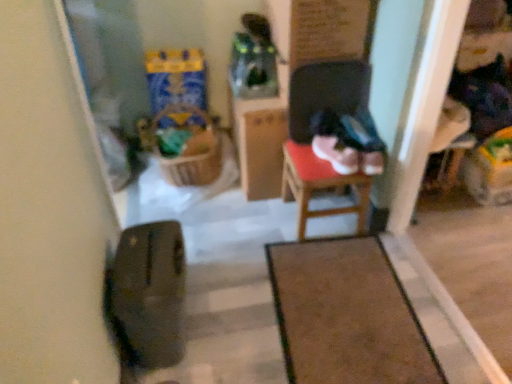
What do you see at coordinates (111, 71) in the screenshot? Image resolution: width=512 pixels, height=384 pixels. I see `transparent glass door at left` at bounding box center [111, 71].

This screenshot has width=512, height=384. Describe the element at coordinates (449, 144) in the screenshot. I see `wooden armchair at right` at that location.

I want to click on woven brown laundry basket at center, so click(x=190, y=156).

Describe the element at coordinates (346, 315) in the screenshot. I see `brown carpet at center` at that location.

This screenshot has height=384, width=512. I want to click on brown carpet at center, so click(x=346, y=315).

Where is `transparent glass door at left`? The height and width of the screenshot is (384, 512). transparent glass door at left is located at coordinates (111, 71).

Are wooden armchair at right and brown carpet at center making contact?

wooden armchair at right and brown carpet at center are not in contact.

Consider the image. Considering the sizes of objects wooden armchair at right and brown carpet at center in the image provided, who is taller, wooden armchair at right or brown carpet at center?

wooden armchair at right is taller.

Is point (458, 151) positioned behind point (350, 299)?

Yes, point (458, 151) is farther from viewer.

Considering the sizes of objects wooden armchair at right and brown carpet at center in the image provided, who is smaller, wooden armchair at right or brown carpet at center?

Smaller between the two is brown carpet at center.

Is point (122, 30) positioned after point (176, 165)?

No.

Considering the sizes of transparent glass door at left and woven brown laundry basket at center in the image, is transparent glass door at left bigger or smaller than woven brown laundry basket at center?

Considering their sizes, transparent glass door at left takes up less space than woven brown laundry basket at center.

Are transparent glass door at left and woven brown laundry basket at center located far from each other?

No, there isn't a large distance between transparent glass door at left and woven brown laundry basket at center.

Locate an element on the screen. laundry basket below the transparent glass door at left (from a real-world perspective) is located at coordinates (190, 156).

Is point (203, 184) closer to viewer compared to point (124, 86)?

Yes, point (203, 184) is closer to viewer.

How different are the orientations of woven brown laundry basket at center and transparent glass door at left in degrees?

They differ by 90.2 degrees in their facing directions.

Between woven brown laundry basket at center and transparent glass door at left, which one has smaller size?

transparent glass door at left.

Does woven brown laundry basket at center turn towards transparent glass door at left?

No.

Is woven brown laundry basket at center situated inside brown carpet at center or outside?

woven brown laundry basket at center is not inside brown carpet at center, it's outside.

Consider the image. From a real-world perspective, who is located higher, woven brown laundry basket at center or brown carpet at center?

woven brown laundry basket at center, from a real-world perspective.

From the image's perspective, does woven brown laundry basket at center appear lower than brown carpet at center?

No, from the image's perspective, woven brown laundry basket at center is not beneath brown carpet at center.

Based on the photo, is woven brown laundry basket at center at the right side of brown carpet at center?

No, woven brown laundry basket at center is not to the right of brown carpet at center.

Does woven brown laundry basket at center contain wooden armchair at right?

That's incorrect, wooden armchair at right is not inside woven brown laundry basket at center.

Is woven brown laundry basket at center directly adjacent to wooden armchair at right?

They are not placed beside each other.

Is woven brown laundry basket at center taller than wooden armchair at right?

No, woven brown laundry basket at center is not taller than wooden armchair at right.

The height and width of the screenshot is (384, 512). In order to click on laundry basket to the left of wooden armchair at right in this screenshot , I will do `click(190, 156)`.

From the picture: Who is more distant, wooden chair at center or woven brown laundry basket at center?

woven brown laundry basket at center.

Looking at the image, does wooden chair at center seem bigger or smaller compared to woven brown laundry basket at center?

wooden chair at center is smaller than woven brown laundry basket at center.

Is wooden chair at center aimed at woven brown laundry basket at center?

No, wooden chair at center is not facing towards woven brown laundry basket at center.

Find the location of a particular element. Image resolution: width=512 pixels, height=384 pixels. laundry basket positioned vertically above the wooden chair at center (from a real-world perspective) is located at coordinates (190, 156).

Is wooden armchair at right spatially inside woven brown laundry basket at center, or outside of it?

wooden armchair at right exists outside the volume of woven brown laundry basket at center.

Is wooden armchair at right bigger or smaller than woven brown laundry basket at center?

Considering their sizes, wooden armchair at right takes up less space than woven brown laundry basket at center.

In terms of height, does wooden armchair at right look taller or shorter compared to woven brown laundry basket at center?

wooden armchair at right is taller than woven brown laundry basket at center.

Does wooden armchair at right appear on the left side of woven brown laundry basket at center?

No, wooden armchair at right is not to the left of woven brown laundry basket at center.

Identify the location of furniture in front of the wooden armchair at right. Image resolution: width=512 pixels, height=384 pixels. pos(346,315).

What are the coordinates of `glass door located above the woven brown laundry basket at center (from a real-world perspective)` in the screenshot? It's located at (111, 71).

Considering their positions, is wooden chair at center positioned further to woven brown laundry basket at center than brown carpet at center?

The object further to woven brown laundry basket at center is brown carpet at center.

Based on their spatial positions, is wooden chair at center or woven brown laundry basket at center closer to transparent glass door at left?

Among the two, woven brown laundry basket at center is located nearer to transparent glass door at left.

Estimate the real-world distances between objects in this image. Which object is further from brown carpet at center, wooden armchair at right or transparent glass door at left?

transparent glass door at left lies further to brown carpet at center than the other object.

Which object lies nearer to the anchor point woven brown laundry basket at center, brown carpet at center or wooden armchair at right?

brown carpet at center is closer to woven brown laundry basket at center.

Estimate the real-world distances between objects in this image. Which object is closer to brown carpet at center, woven brown laundry basket at center or wooden chair at center?

The object closer to brown carpet at center is wooden chair at center.

Looking at the image, which one is located closer to wooden chair at center, woven brown laundry basket at center or brown carpet at center?

brown carpet at center is positioned closer to the anchor wooden chair at center.

Estimate the real-world distances between objects in this image. Which object is closer to woven brown laundry basket at center, wooden chair at center or transparent glass door at left?

transparent glass door at left lies closer to woven brown laundry basket at center than the other object.

Looking at the image, which one is located further to wooden armchair at right, transparent glass door at left or wooden chair at center?

transparent glass door at left is positioned further to the anchor wooden armchair at right.

This screenshot has height=384, width=512. I want to click on laundry basket located between transparent glass door at left and brown carpet at center in the left-right direction, so click(x=190, y=156).

Identify the location of laundry basket between transparent glass door at left and wooden armchair at right in the horizontal direction. [x=190, y=156].

This screenshot has height=384, width=512. What are the coordinates of `table located between woven brown laundry basket at center and wooden armchair at right in the left-right direction` in the screenshot? It's located at (320, 186).

The image size is (512, 384). I want to click on laundry basket located between transparent glass door at left and wooden chair at center in the left-right direction, so coord(190,156).